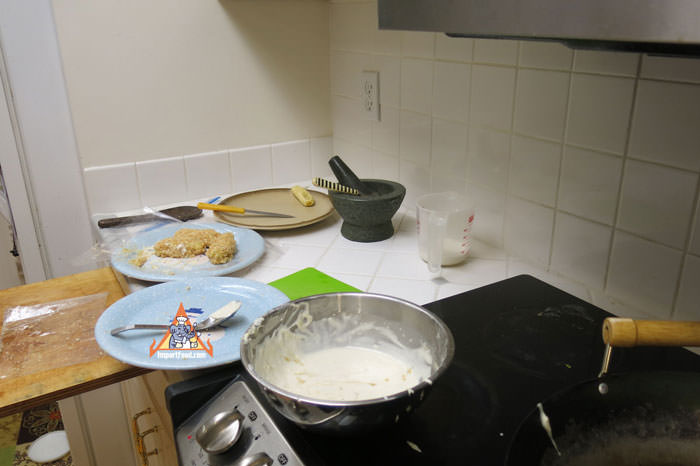
Image resolution: width=700 pixels, height=466 pixels. I want to click on knife handle, so click(x=215, y=206).